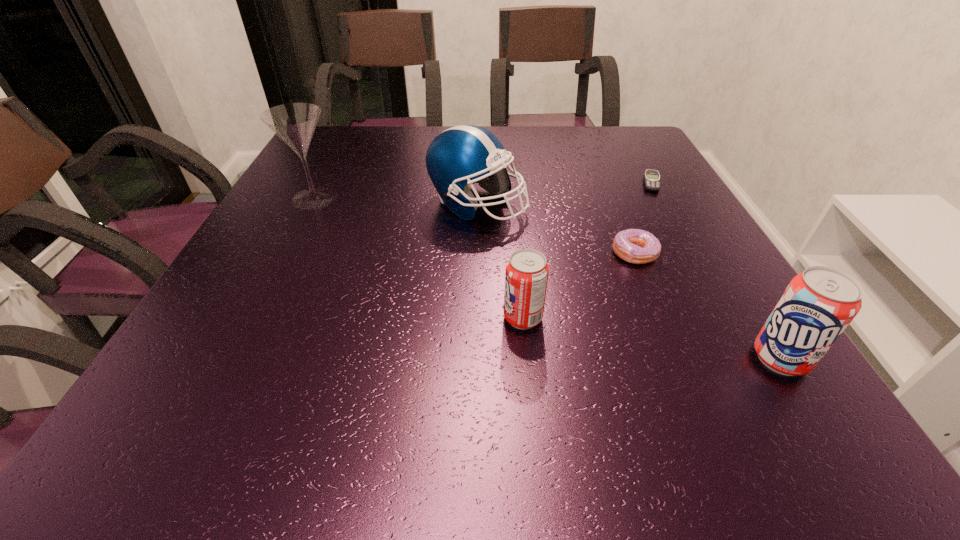
In the image, there is a desktop. Where is `free region at the far edge`? The width and height of the screenshot is (960, 540). free region at the far edge is located at coordinates (364, 160).

At what (x,y) coordinates should I click in order to perform the action: click on vacant space at the left edge of the desktop. Please return your answer as a coordinate pair (x, y). Image resolution: width=960 pixels, height=540 pixels. Looking at the image, I should click on (322, 173).

Where is `vacant region at the right edge of the desktop`? This screenshot has height=540, width=960. vacant region at the right edge of the desktop is located at coordinates (723, 327).

The height and width of the screenshot is (540, 960). Find the location of `blank space at the far left corner`. blank space at the far left corner is located at coordinates (331, 132).

This screenshot has height=540, width=960. In order to click on vacant space at the near left corner of the desktop in this screenshot , I will do `click(261, 377)`.

The image size is (960, 540). I want to click on free spot at the far right corner of the desktop, so click(656, 152).

You are a GUI agent. You are given a task and a screenshot of the screen. Output one action in this format:
    pyautogui.click(x=<x>, y=<y>)
    Task: Click on the vacant area that lies between the football helmet and the beeper
    This screenshot has height=540, width=960.
    Given the screenshot: What is the action you would take?
    pyautogui.click(x=564, y=193)

The width and height of the screenshot is (960, 540). In order to click on empty space that is in between the shortest object and the football helmet in this screenshot , I will do `click(564, 193)`.

Locate an element on the screen. empty location between the right soda can and the football helmet is located at coordinates (629, 281).

Identify the location of unoccupied position between the football helmet and the doughnut. (556, 228).